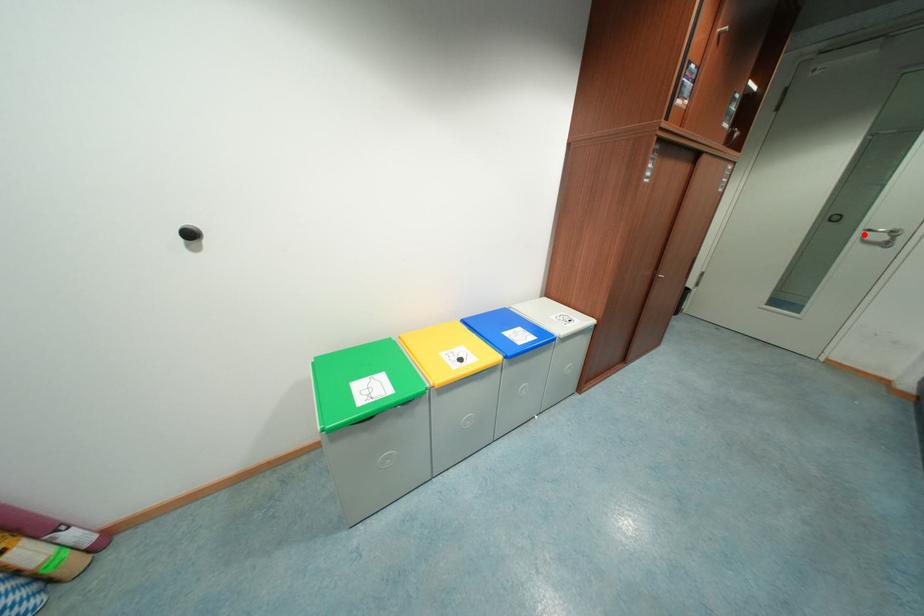
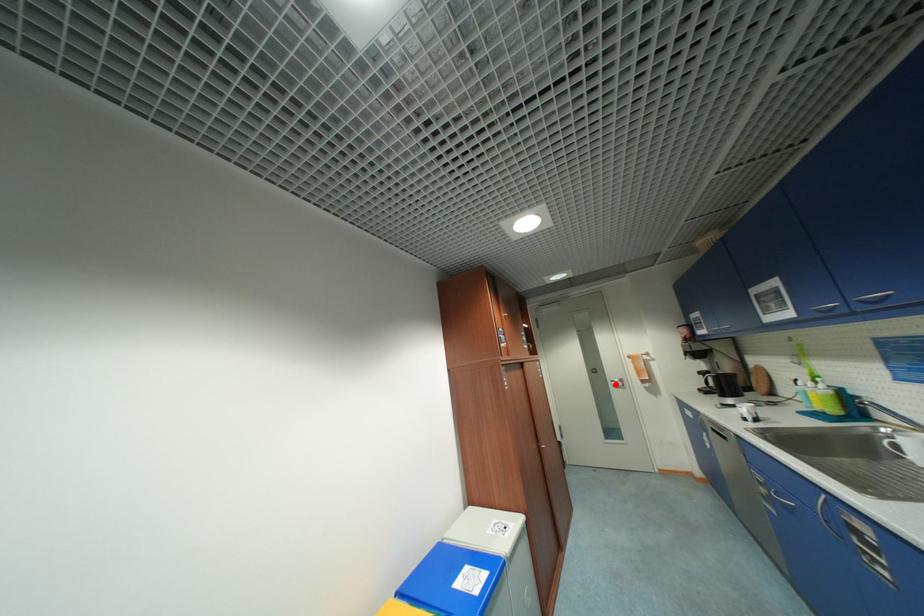
I am providing you with two images of the same scene from different viewpoints. A red point is marked on the first image and another point is marked on the second image. Is the red point in image1 aligned with the point shown in image2?

Yes